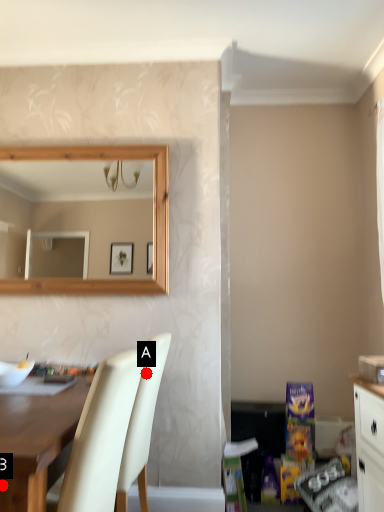
Question: Two points are circled on the image, labeled by A and B beside each circle. Which point is further to the camera?

Choices:
 (A) A is further
 (B) B is further

Answer: (A)